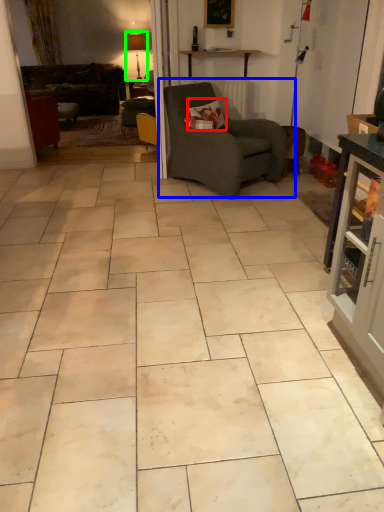
Question: Considering the real-world distances, which object is closest to pillow (highlighted by a red box)? chair (highlighted by a blue box) or lamp (highlighted by a green box).

Choices:
 (A) chair
 (B) lamp

Answer: (A)